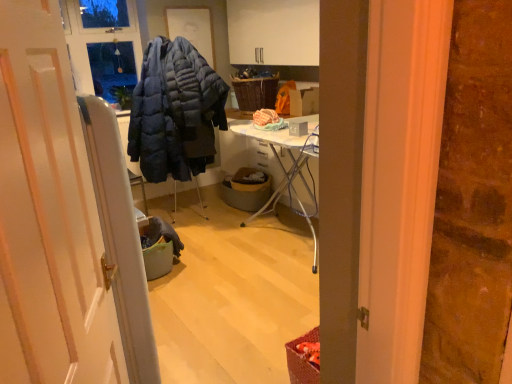
Question: Is white glossy door at center behind brown woven basket at center?

Choices:
 (A) no
 (B) yes

Answer: (A)

Question: From the image's perspective, is white glossy door at center located beneath brown woven basket at center?

Choices:
 (A) yes
 (B) no

Answer: (A)

Question: Considering the relative sizes of white glossy door at center and brown woven basket at center in the image provided, is white glossy door at center wider than brown woven basket at center?

Choices:
 (A) yes
 (B) no

Answer: (B)

Question: Is white glossy door at center smaller than brown woven basket at center?

Choices:
 (A) yes
 (B) no

Answer: (B)

Question: Can you confirm if white glossy door at center is thinner than brown woven basket at center?

Choices:
 (A) yes
 (B) no

Answer: (A)

Question: Is white glossy door at center positioned before brown woven basket at center?

Choices:
 (A) no
 (B) yes

Answer: (B)

Question: Are woven brown picnic basket at center and white glossy door at center located far from each other?

Choices:
 (A) yes
 (B) no

Answer: (A)

Question: Is woven brown picnic basket at center completely or partially outside of white glossy door at center?

Choices:
 (A) yes
 (B) no

Answer: (A)

Question: Is the position of woven brown picnic basket at center less distant than that of white glossy door at center?

Choices:
 (A) yes
 (B) no

Answer: (B)

Question: Does woven brown picnic basket at center have a smaller size compared to white glossy door at center?

Choices:
 (A) yes
 (B) no

Answer: (A)

Question: Does woven brown picnic basket at center have a greater width compared to white glossy door at center?

Choices:
 (A) yes
 (B) no

Answer: (A)

Question: Is woven brown picnic basket at center surrounding white glossy door at center?

Choices:
 (A) yes
 (B) no

Answer: (B)

Question: Is white glossy door at center positioned in front of woven brown picnic basket at center?

Choices:
 (A) yes
 (B) no

Answer: (A)